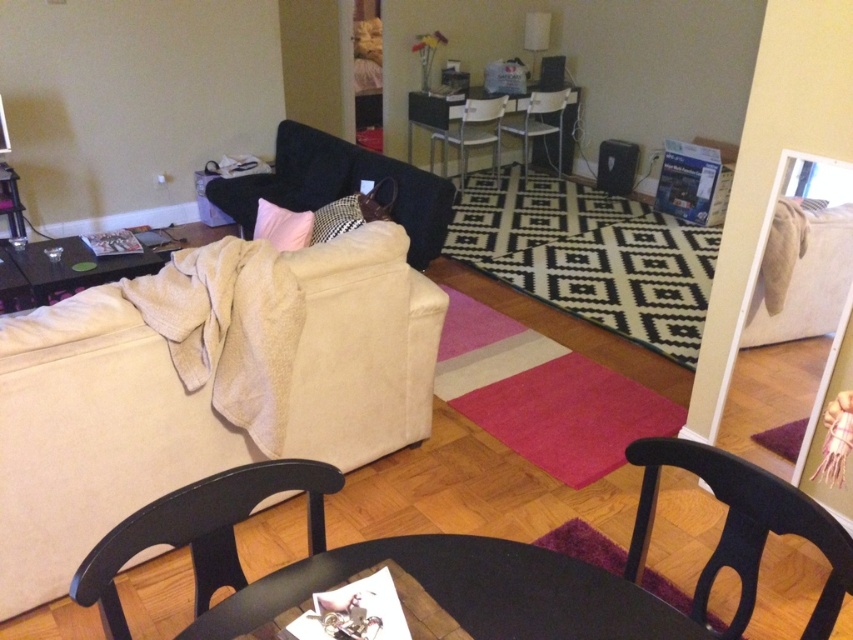
Can you confirm if beige fabric couch at left is positioned below metallic silver armchair at center?

Yes.

Which is in front, point (206, 268) or point (496, 140)?

Point (206, 268) is more forward.

Find the location of a particular element. Image resolution: width=853 pixels, height=640 pixels. beige fabric couch at left is located at coordinates (202, 385).

Can you confirm if wooden glossy table at center is positioned below pink fabric pillow at center?

Incorrect, wooden glossy table at center is not positioned below pink fabric pillow at center.

Who is positioned more to the left, wooden glossy table at center or pink fabric pillow at center?

Positioned to the left is pink fabric pillow at center.

Which is in front, point (469, 124) or point (277, 243)?

Point (277, 243) is in front.

Where is `wooden glossy table at center`? This screenshot has height=640, width=853. wooden glossy table at center is located at coordinates (485, 120).

Is black wood armchair at lower center bigger than checkered fabric pillow at center?

Yes.

Which of these two, black wood armchair at lower center or checkered fabric pillow at center, stands taller?

checkered fabric pillow at center

Between point (171, 525) and point (318, 230), which one is positioned behind?

Positioned behind is point (318, 230).

What are the coordinates of `black wood armchair at lower center` in the screenshot? It's located at (201, 531).